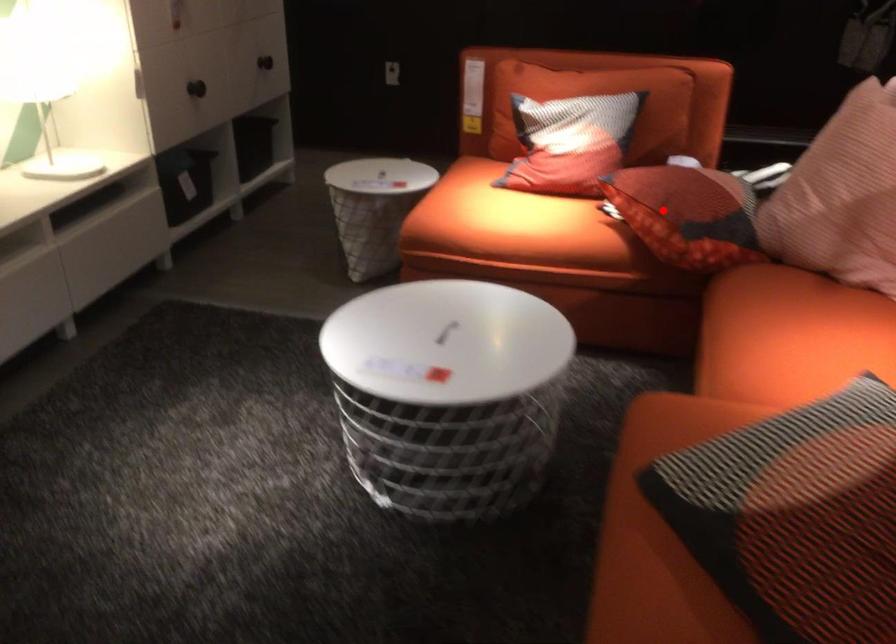
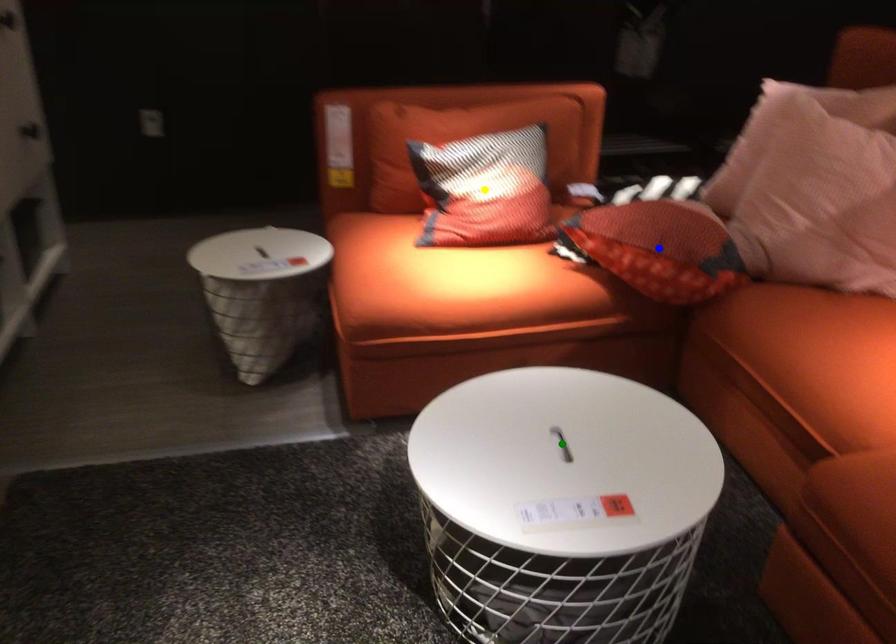
Question: I am providing you with two images of the same scene from different viewpoints. A red point is marked on the first image. You are given multiple points on the second image. Which spot in image 2 lines up with the point in image 1?

Choices:
 (A) blue point
 (B) green point
 (C) yellow point

Answer: (A)